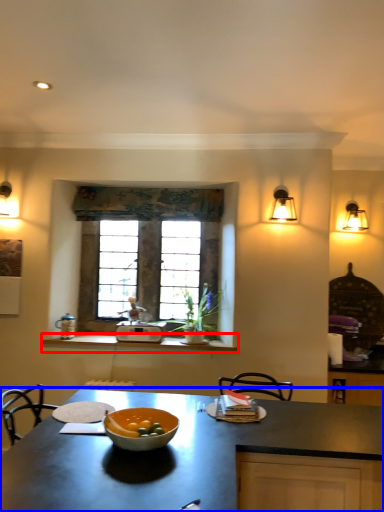
Question: Which object is closer to the camera taking this photo, counter (highlighted by a red box) or countertop (highlighted by a blue box)?

Choices:
 (A) counter
 (B) countertop

Answer: (B)